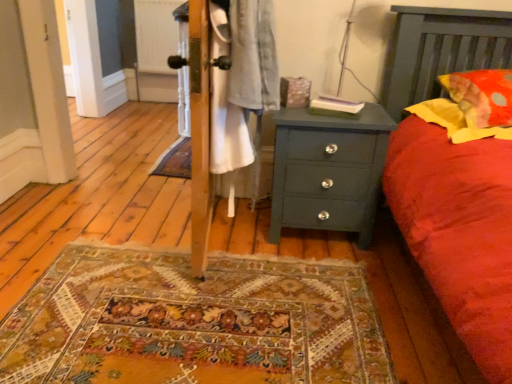
Question: Does soft yellow fabric pillow at right, the second pillow viewed from the top, have a greater height compared to teal painted wood chest of drawers at center?

Choices:
 (A) yes
 (B) no

Answer: (B)

Question: Considering the relative sizes of soft yellow fabric pillow at right, the second pillow viewed from the top, and teal painted wood chest of drawers at center in the image provided, is soft yellow fabric pillow at right, the second pillow viewed from the top, shorter than teal painted wood chest of drawers at center?

Choices:
 (A) yes
 (B) no

Answer: (A)

Question: Is soft yellow fabric pillow at right, marked as the 1th pillow in a bottom-to-top arrangement, touching teal painted wood chest of drawers at center?

Choices:
 (A) yes
 (B) no

Answer: (B)

Question: From the image's perspective, is soft yellow fabric pillow at right, the second pillow viewed from the top, above teal painted wood chest of drawers at center?

Choices:
 (A) yes
 (B) no

Answer: (A)

Question: Does soft yellow fabric pillow at right, marked as the 1th pillow in a bottom-to-top arrangement, have a smaller size compared to teal painted wood chest of drawers at center?

Choices:
 (A) yes
 (B) no

Answer: (A)

Question: Is teal painted wood chest of drawers at center bigger or smaller than soft yellow fabric pillow at right, the second pillow viewed from the top?

Choices:
 (A) big
 (B) small

Answer: (A)

Question: Considering the positions of teal painted wood chest of drawers at center and soft yellow fabric pillow at right, the second pillow viewed from the top, in the image, is teal painted wood chest of drawers at center taller or shorter than soft yellow fabric pillow at right, the second pillow viewed from the top,?

Choices:
 (A) tall
 (B) short

Answer: (A)

Question: Relative to soft yellow fabric pillow at right, the second pillow viewed from the top, is teal painted wood chest of drawers at center in front or behind?

Choices:
 (A) front
 (B) behind

Answer: (B)

Question: Considering the relative positions of teal painted wood chest of drawers at center and soft yellow fabric pillow at right, the second pillow viewed from the top, in the image provided, is teal painted wood chest of drawers at center to the left or to the right of soft yellow fabric pillow at right, the second pillow viewed from the top,?

Choices:
 (A) right
 (B) left

Answer: (B)

Question: From a real-world perspective, is soft yellow fabric pillow at right, marked as the 1th pillow in a bottom-to-top arrangement, above or below yellow fabric pillow at right, which appears as the second pillow when ordered from the bottom?

Choices:
 (A) above
 (B) below

Answer: (B)

Question: Is soft yellow fabric pillow at right, marked as the 1th pillow in a bottom-to-top arrangement, taller or shorter than yellow fabric pillow at right, which appears as the second pillow when ordered from the bottom?

Choices:
 (A) tall
 (B) short

Answer: (B)

Question: From the image's perspective, is soft yellow fabric pillow at right, the second pillow viewed from the top, above or below yellow fabric pillow at right, arranged as the first pillow when viewed from the top?

Choices:
 (A) below
 (B) above

Answer: (A)

Question: Looking at the image, does soft yellow fabric pillow at right, the second pillow viewed from the top, seem bigger or smaller compared to yellow fabric pillow at right, which appears as the second pillow when ordered from the bottom?

Choices:
 (A) big
 (B) small

Answer: (B)

Question: From the image's perspective, relative to yellow fabric pillow at right, which appears as the second pillow when ordered from the bottom, is white wood screen door at left above or below?

Choices:
 (A) above
 (B) below

Answer: (A)

Question: Considering their positions, is white wood screen door at left located in front of or behind yellow fabric pillow at right, which appears as the second pillow when ordered from the bottom?

Choices:
 (A) behind
 (B) front

Answer: (A)